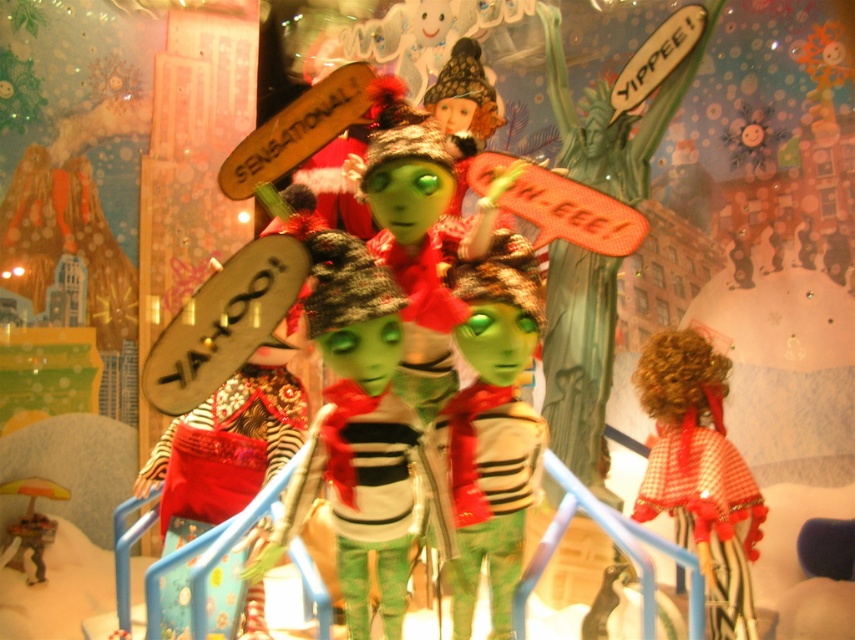
Question: Which of the following is the closest to the observer?

Choices:
 (A) red plaid dress at right
 (B) matte green doll at center
 (C) metallic gold umbrella at lower left

Answer: (B)

Question: Which object is positioned farthest from the matte green doll at center?

Choices:
 (A) red plaid dress at right
 (B) metallic gold umbrella at lower left

Answer: (B)

Question: Can you confirm if red plaid dress at right is wider than metallic gold umbrella at lower left?

Choices:
 (A) no
 (B) yes

Answer: (B)

Question: Can you confirm if matte green doll at center is positioned above metallic gold umbrella at lower left?

Choices:
 (A) no
 (B) yes

Answer: (B)

Question: Which point is farther to the camera?

Choices:
 (A) click(x=3, y=556)
 (B) click(x=752, y=540)
 (C) click(x=329, y=246)

Answer: (A)

Question: Considering the relative positions of matte green doll at center and metallic gold umbrella at lower left in the image provided, where is matte green doll at center located with respect to metallic gold umbrella at lower left?

Choices:
 (A) left
 (B) right

Answer: (B)